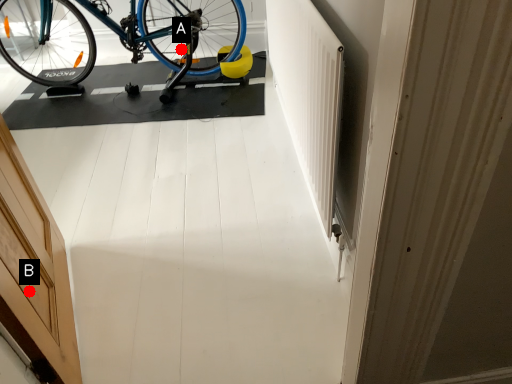
Question: Two points are circled on the image, labeled by A and B beside each circle. Which of the following is the farthest from the observer?

Choices:
 (A) A is further
 (B) B is further

Answer: (A)